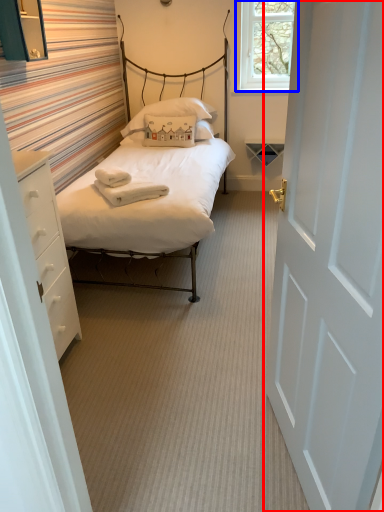
Question: Which of the following is the closest to the observer, door (highlighted by a red box) or window (highlighted by a blue box)?

Choices:
 (A) door
 (B) window

Answer: (A)